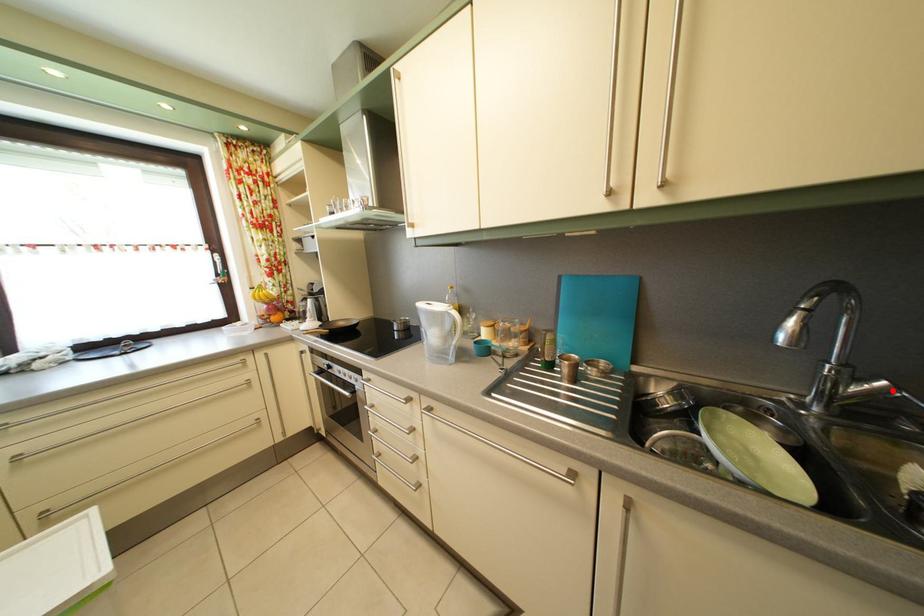
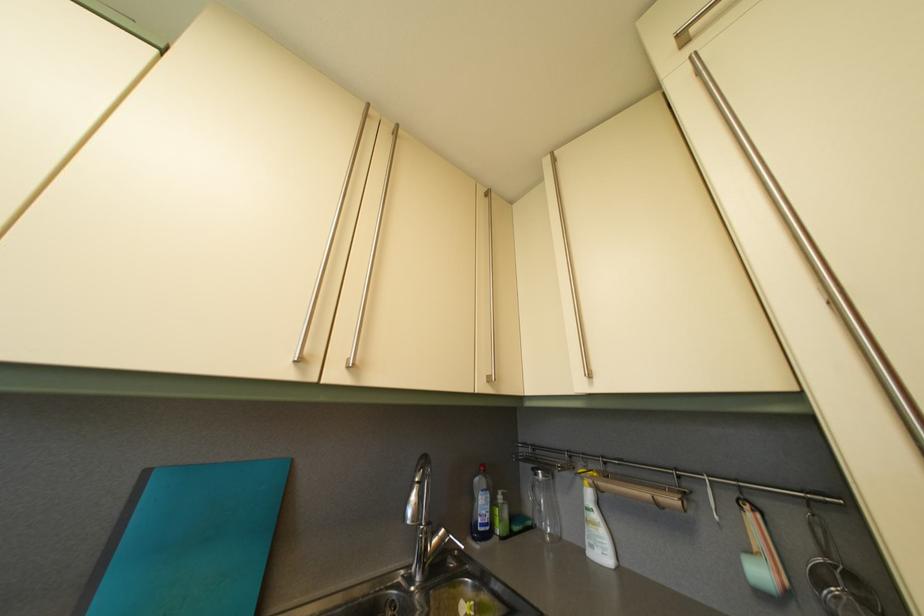
Find the pixel in the second image that matches the highlighted location in the first image.

(451, 539)